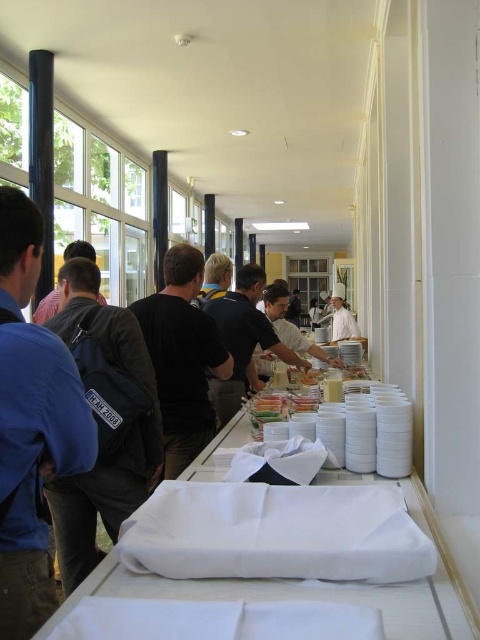
Which of these two, blue shirt at left or white fabric at center, stands shorter?

Standing shorter between the two is white fabric at center.

Does point (24, 260) come farther from viewer compared to point (335, 317)?

No, it is not.

What are the coordinates of `blue shirt at left` in the screenshot? It's located at (32, 422).

Which is above, white cloth at center or white fabric at center?

white fabric at center

What do you see at coordinates (324, 588) in the screenshot?
I see `white cloth at center` at bounding box center [324, 588].

Where is `white cloth at center`? white cloth at center is located at coordinates (324, 588).

Looking at this image, between blue shirt at left and white cloth at center, which one appears on the left side from the viewer's perspective?

blue shirt at left

Can you confirm if blue shirt at left is smaller than white cloth at center?

Yes, blue shirt at left is smaller than white cloth at center.

Does point (40, 465) come farther from viewer compared to point (414, 627)?

That is True.

Locate an element on the screen. Image resolution: width=480 pixels, height=640 pixels. blue shirt at left is located at coordinates (32, 422).